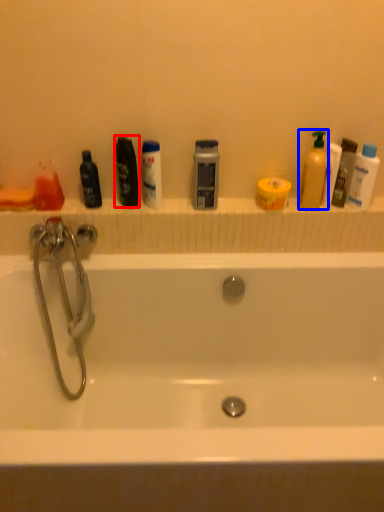
Question: Which of the following is the closest to the observer, mouthwash (highlighted by a red box) or cleaning product (highlighted by a blue box)?

Choices:
 (A) mouthwash
 (B) cleaning product

Answer: (B)